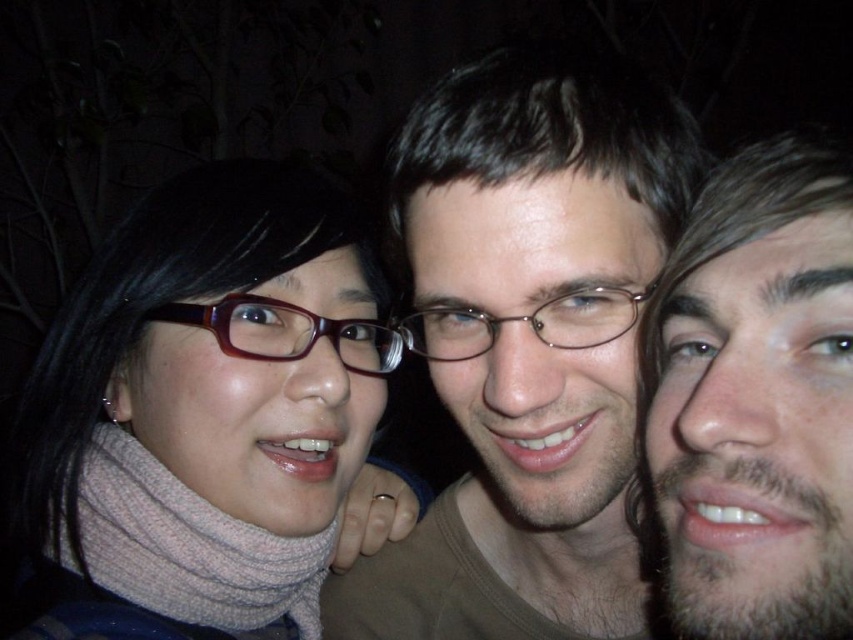
Question: Can you confirm if matte brown hair at left is positioned to the right of beige facial hair at right?

Choices:
 (A) no
 (B) yes

Answer: (A)

Question: Which point is farther to the camera?

Choices:
 (A) (683, 456)
 (B) (611, 316)

Answer: (B)

Question: Which point is farther to the camera?

Choices:
 (A) (196, 305)
 (B) (363, 380)

Answer: (B)

Question: Which of the following is the closest to the observer?

Choices:
 (A) (363, 544)
 (B) (195, 307)
 (C) (552, 316)
 (D) (767, 454)

Answer: (D)

Question: Is matte brown hair at left above beige facial hair at right?

Choices:
 (A) yes
 (B) no

Answer: (B)

Question: Does matte brown hair at center appear on the right side of matte plastic glasses at center?

Choices:
 (A) yes
 (B) no

Answer: (A)